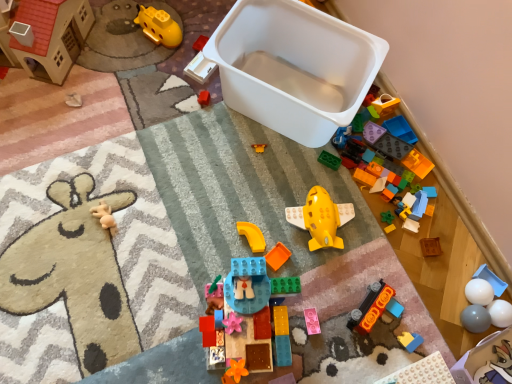
At what (x,y) coordinates should I click in order to perform the action: click on vacant space that's between pink matte block at center, the 7th toy from the left, and yellow matte airplane at center, the ninth toy from the right. Please return your answer as a coordinate pair (x, y). Looking at the image, I should click on (319, 288).